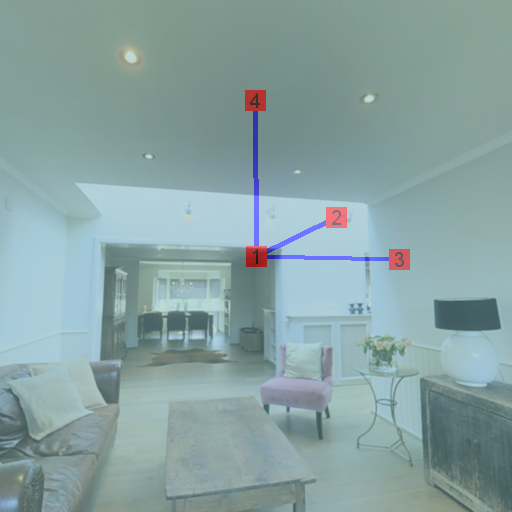
The height and width of the screenshot is (512, 512). I want to click on wall, so click(510, 234).